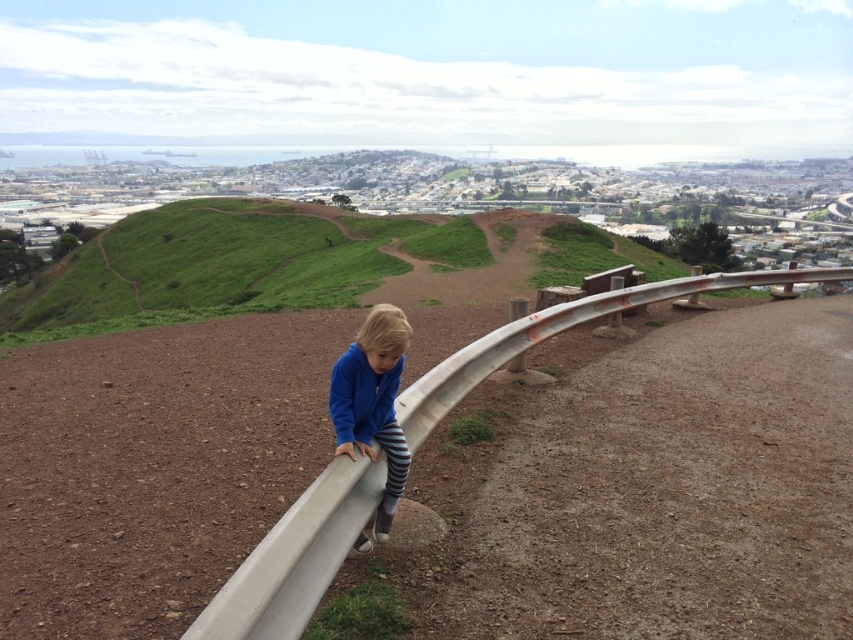
Who is higher up, green grassy hillside at upper center or blue fleece jacket at center?

Positioned higher is green grassy hillside at upper center.

Between green grassy hillside at upper center and blue fleece jacket at center, which one appears on the left side from the viewer's perspective?

From the viewer's perspective, green grassy hillside at upper center appears more on the left side.

Image resolution: width=853 pixels, height=640 pixels. I want to click on green grassy hillside at upper center, so click(x=225, y=266).

Locate an element on the screen. green grassy hillside at upper center is located at coordinates (225, 266).

Does white matte rail at center have a lesser height compared to blue fleece jacket at center?

In fact, white matte rail at center may be taller than blue fleece jacket at center.

Find the location of a particular element. white matte rail at center is located at coordinates (558, 332).

This screenshot has height=640, width=853. Find the location of `white matte rail at center`. white matte rail at center is located at coordinates (558, 332).

Can you confirm if green grassy hillside at upper center is thinner than white matte rail at center?

In fact, green grassy hillside at upper center might be wider than white matte rail at center.

Does point (282, 209) lie behind point (653, 300)?

That is True.

Identify the location of green grassy hillside at upper center. Image resolution: width=853 pixels, height=640 pixels. (225, 266).